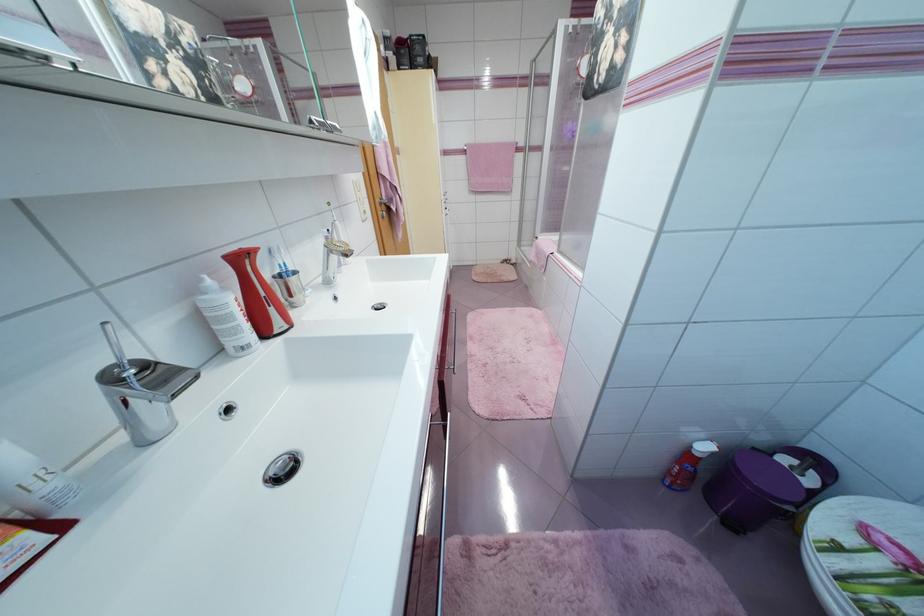
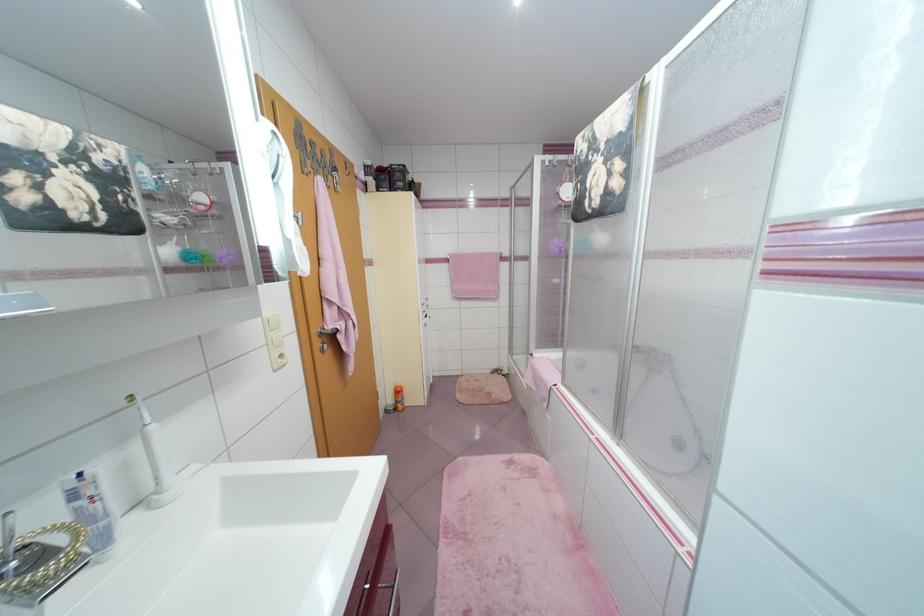
Question: Which direction would the cameraman need to move to produce the second image? Reply with the corresponding letter.

Choices:
 (A) Left
 (B) Right
 (C) Forward
 (D) Backward

Answer: (C)